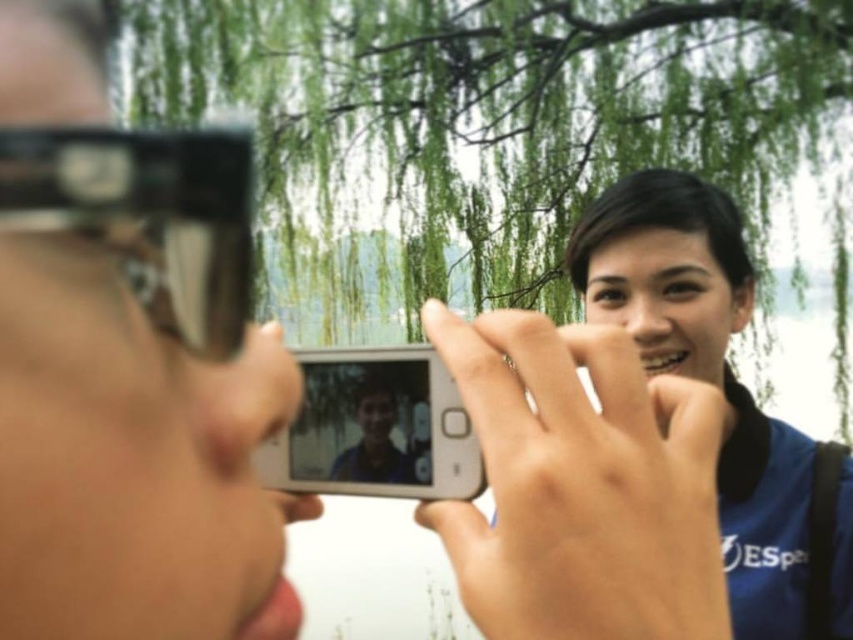
You are trying to decide which object to place in a small display case that can only accommodate items up to the size of the white glossy smartphone at center. Based on the scene, can the matte black goggles at upper left fit in the display case?

The matte black goggles at upper left is bigger than the white glossy smartphone at center, so it cannot fit in the display case designed for items up to the size of the white glossy smartphone at center.

You are trying to place the matte black goggles at upper left and the white glossy smartphone at center on a narrow shelf. Which object should you place first to ensure both fit side by side?

The white glossy smartphone at center should be placed first since it might be narrower than the matte black goggles at upper left, allowing both to fit on the narrow shelf.